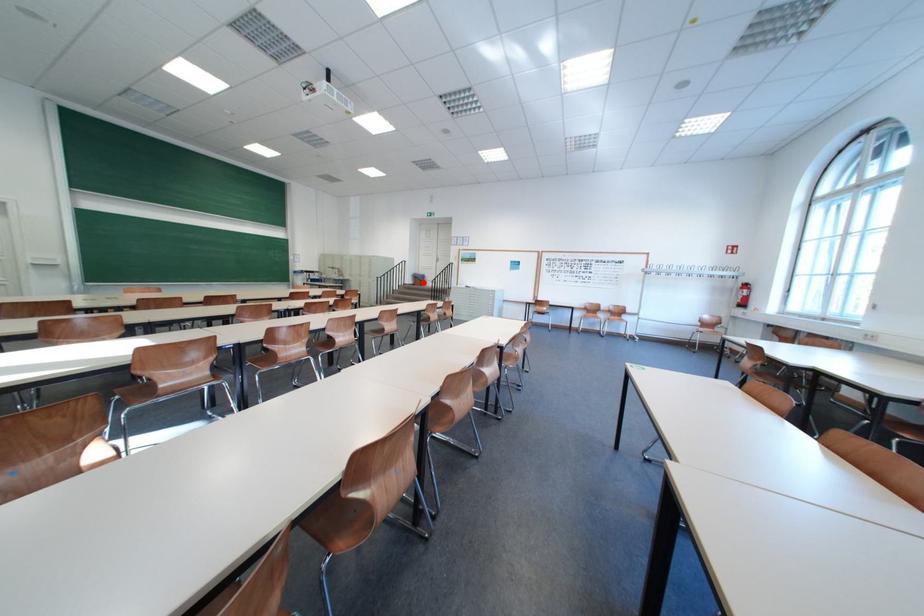
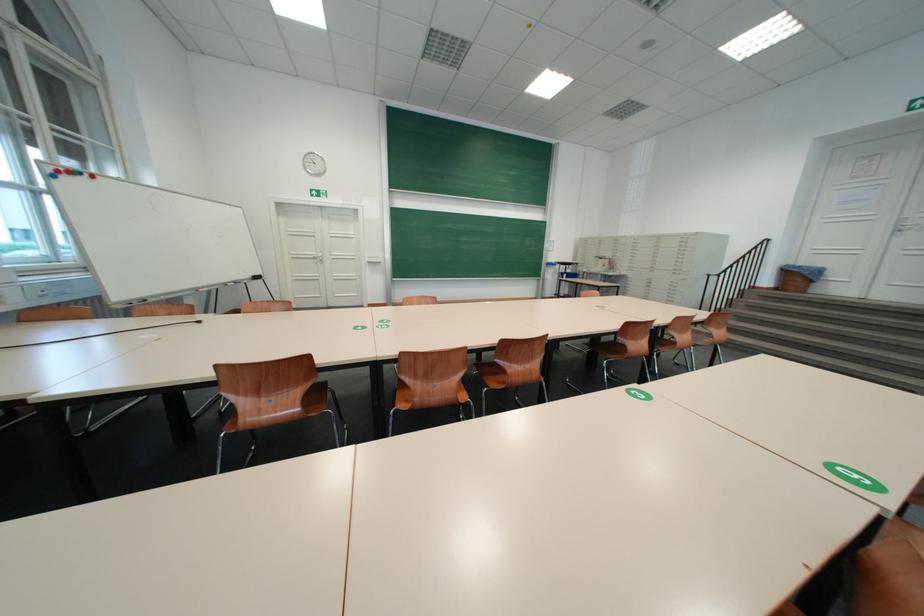
The point at the highlighted location is marked in the first image. Where is the corresponding point in the second image?

(781, 283)